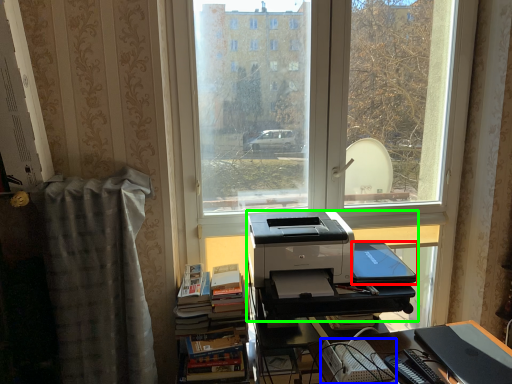
Question: Which object is the farthest from register (highlighted by a red box)? Choose among these: paperback book (highlighted by a blue box) or printer (highlighted by a green box).

Choices:
 (A) paperback book
 (B) printer

Answer: (A)